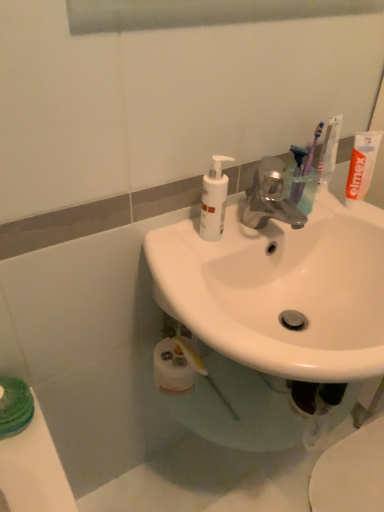
Locate an element on the screen. vacant region above white glossy toilet at lower right (from a real-world perspective) is located at coordinates (348, 476).